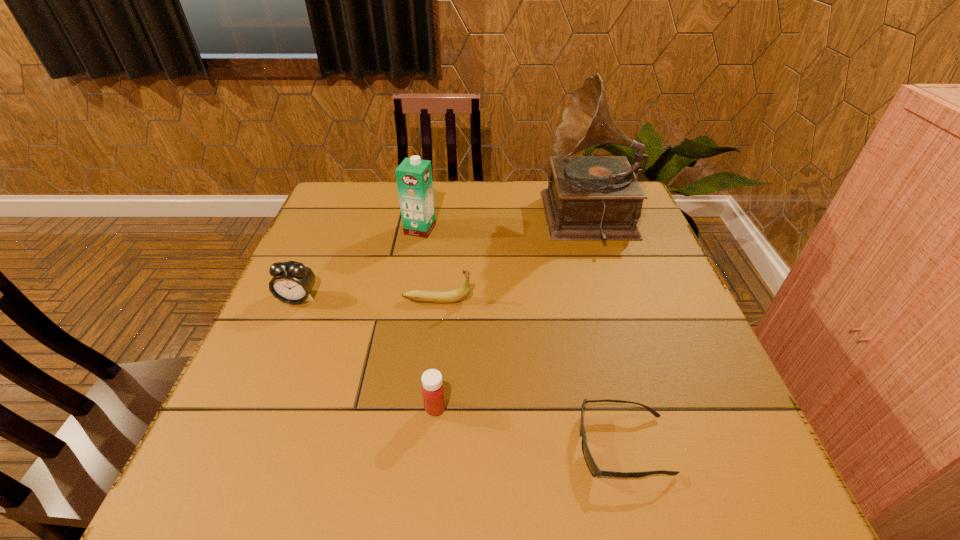
Locate an element on the screen. This screenshot has height=540, width=960. free point between the shortest object and the banana is located at coordinates (530, 373).

The height and width of the screenshot is (540, 960). I want to click on vacant region between the carton and the leftmost object, so click(x=359, y=264).

You are a GUI agent. You are given a task and a screenshot of the screen. Output one action in this format:
    pyautogui.click(x=<x>, y=<y>)
    Task: Click on the vacant space in between the tallest object and the medicine
    The image size is (960, 540).
    Given the screenshot: What is the action you would take?
    pyautogui.click(x=514, y=314)

I want to click on free space between the record player and the banana, so click(x=514, y=260).

Locate an element on the screen. This screenshot has width=960, height=540. free spot between the record player and the banana is located at coordinates (514, 260).

Identify the location of free space between the medicine and the sunglasses. pyautogui.click(x=529, y=427).

Find the location of a particular element. This screenshot has height=540, width=960. free space between the carton and the shortest object is located at coordinates (521, 338).

Image resolution: width=960 pixels, height=540 pixels. Identify the location of free area in between the sunglasses and the tallest object. (607, 333).

Identify which object is the fifth nearest to the leftmost object. Please provide its 2D coordinates. Your answer should be formatted as a tuple, i.e. [(x, y)], where the tuple contains the x and y coordinates of a point satisfying the conditions above.

[(593, 468)]

Image resolution: width=960 pixels, height=540 pixels. I want to click on object identified as the second closest to the second tallest object, so click(x=292, y=282).